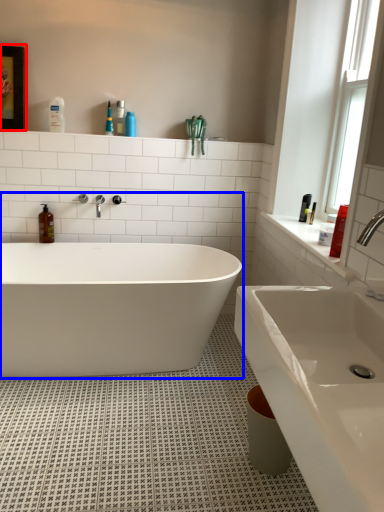
Question: Which point is further to the camera, medicine cabinet (highlighted by a red box) or bathtub (highlighted by a blue box)?

Choices:
 (A) medicine cabinet
 (B) bathtub

Answer: (A)